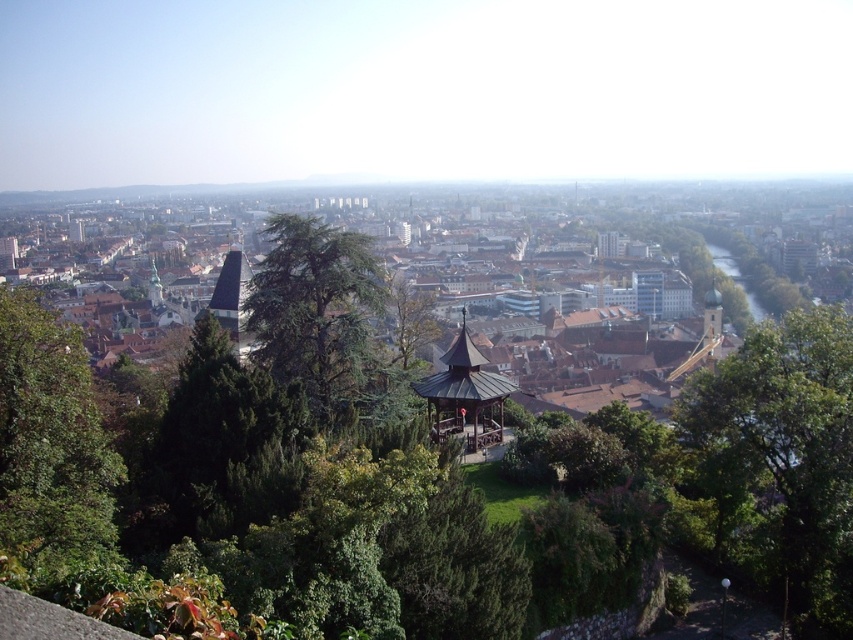
You are a city planner analyzing the urban green spaces. You notice the green leafy tree at right and the green textured tree at center. Which tree would cast a larger shadow during midday when the sun is directly overhead?

The green leafy tree at right is bigger than the green textured tree at center, so it would cast a larger shadow during midday when the sun is directly overhead.

You are standing at the base of a 1.8 meter tall statue and want to take a photo of the green leafy tree at right. If your camera can focus on objects up to 50 meters away, will you be able to capture the tree clearly?

The green leafy tree at right is 60.09 meters from viewer, which is beyond the camera focus range of 50 meters. The tree will not be in focus.